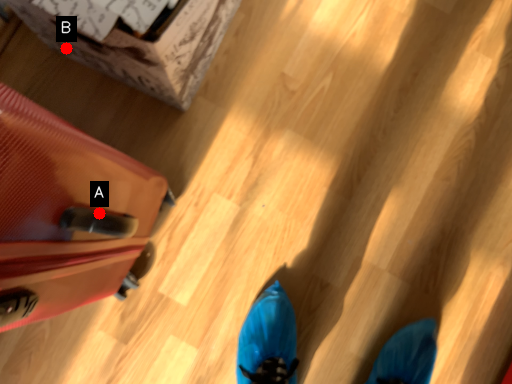
Question: Two points are circled on the image, labeled by A and B beside each circle. Which point is farther from the camera taking this photo?

Choices:
 (A) A is further
 (B) B is further

Answer: (B)